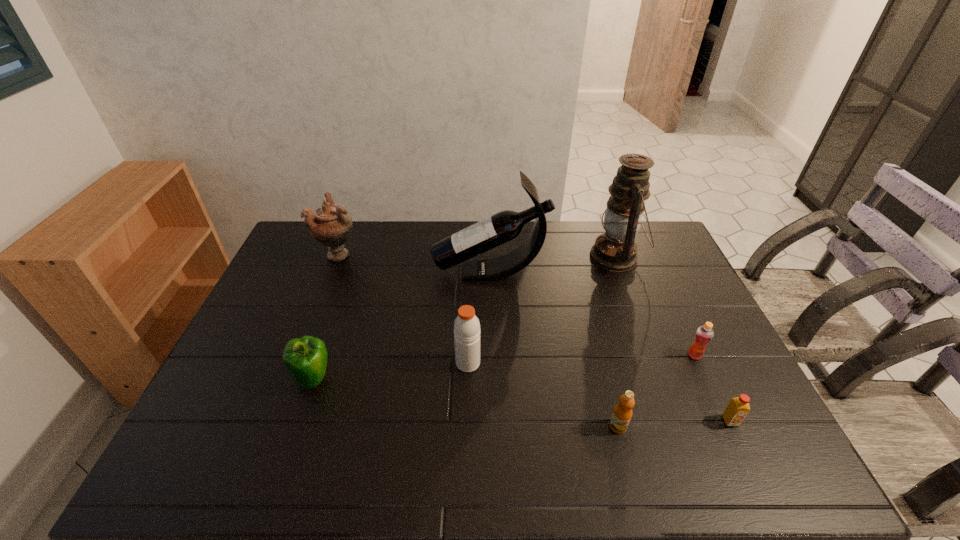
You are a GUI agent. You are given a task and a screenshot of the screen. Output one action in this format:
    pyautogui.click(x=<x>, y=<y>)
    Task: Click on the lantern
    Image resolution: width=960 pixels, height=540 pixels.
    Given the screenshot: What is the action you would take?
    pyautogui.click(x=615, y=250)

Where is `wine bottle`? The image size is (960, 540). wine bottle is located at coordinates (504, 226).

Image resolution: width=960 pixels, height=540 pixels. In order to click on urn in this screenshot , I will do `click(330, 225)`.

At what (x,y) coordinates should I click in order to perform the action: click on shaker. Please return your answer as a coordinate pair (x, y). Image resolution: width=960 pixels, height=540 pixels. Looking at the image, I should click on (467, 332).

Locate an element on the screen. the fourth shortest object is located at coordinates (306, 358).

Identify the location of the fifth object from left to right. (622, 414).

This screenshot has height=540, width=960. Identify the location of the farthest orange juice. (704, 334).

Find the location of `the shortest orange juice`. the shortest orange juice is located at coordinates click(x=738, y=408).

I want to click on vacant area situated on the left of the lantern, so click(483, 257).

I want to click on free space located on the stand of the wine bottle, so click(369, 273).